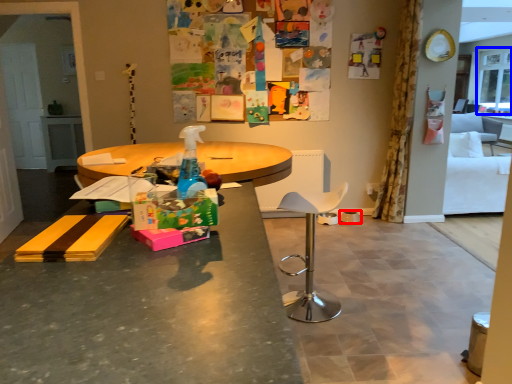
Question: Which object appears closest to the camera in this image, bowl (highlighted by a red box) or window screen (highlighted by a blue box)?

Choices:
 (A) bowl
 (B) window screen

Answer: (A)